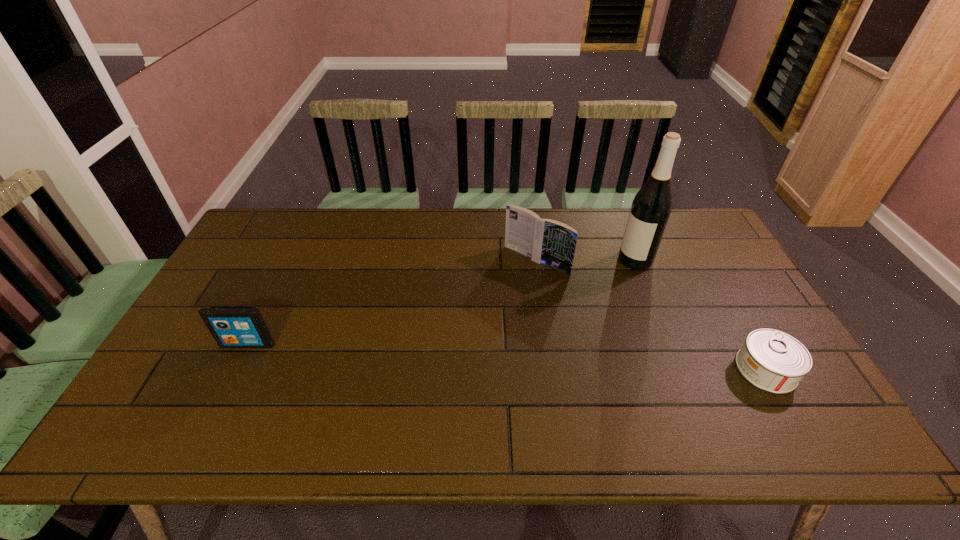
At what (x,y) coordinates should I click in order to perform the action: click on free point that satisfies the following two spatial constraints: 1. on the front screen of the can; 2. on the left side of the iPod. Please return your answer as a coordinate pair (x, y). The height and width of the screenshot is (540, 960). Looking at the image, I should click on (236, 369).

This screenshot has width=960, height=540. Identify the location of free space that satisfies the following two spatial constraints: 1. on the front screen of the can; 2. on the right side of the leftmost object. (236, 369).

In order to click on vacant area that satisfies the following two spatial constraints: 1. on the front screen of the can; 2. on the right side of the leftmost object in this screenshot , I will do `click(236, 369)`.